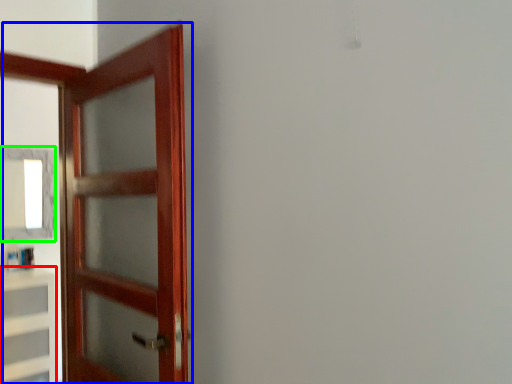
Question: Which is nearer to the cabinetry (highlighted by a red box)? door (highlighted by a blue box) or mirror (highlighted by a green box).

Choices:
 (A) door
 (B) mirror

Answer: (B)